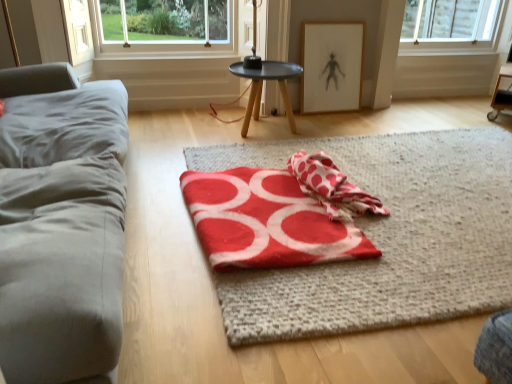
Find the location of a particular element. This screenshot has width=512, height=384. free point in front of red polka dot towel at center, which appears as the 1th beach towel when viewed from the right is located at coordinates (399, 253).